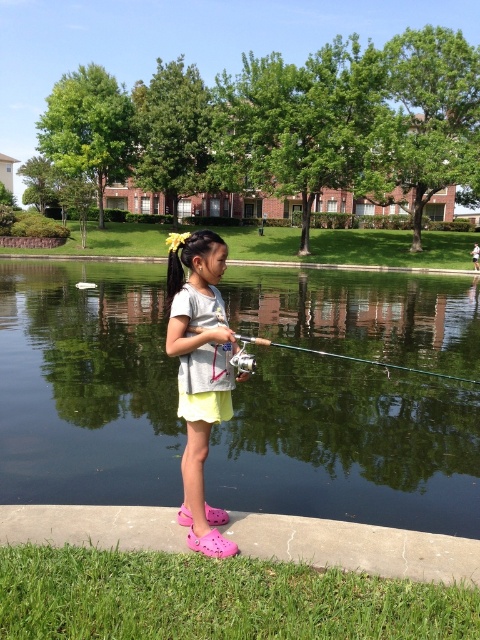
You are a photographer trying to capture the green reflective water at center and the metallic silver fishing pole at center in the same frame. Given that your camera has a maximum focal length that allows capturing objects within 5 meters of each other, will you be able to include both in a single shot?

The green reflective water at center and metallic silver fishing pole at center are 5.85 meters apart from each other. Since the camera can only capture objects within 5 meters of each other, the distance is too great to include both in a single shot.

You are a delivery robot with a 2.5 meter long package that needs to be carried through the area where the light gray cotton shirt at center and metallic silver fishing pole at center are located. Can you safely navigate the space between them without dropping the package?

The distance between the light gray cotton shirt at center and the metallic silver fishing pole at center is 3.23 meters. Since the package is 2.5 meters long, the robot can safely navigate the space between them as the distance is sufficient to accommodate the package length.